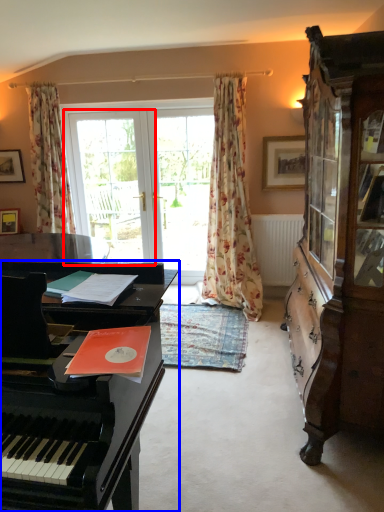
Question: Which point is further to the camera, screen door (highlighted by a red box) or piano (highlighted by a blue box)?

Choices:
 (A) screen door
 (B) piano

Answer: (A)